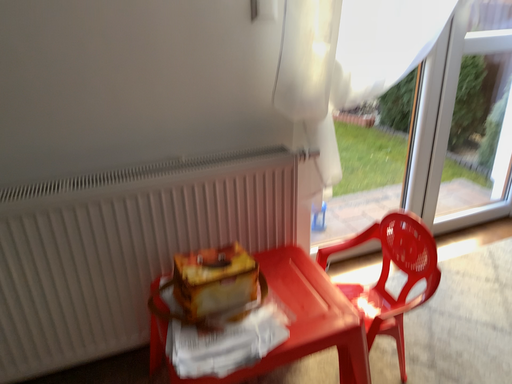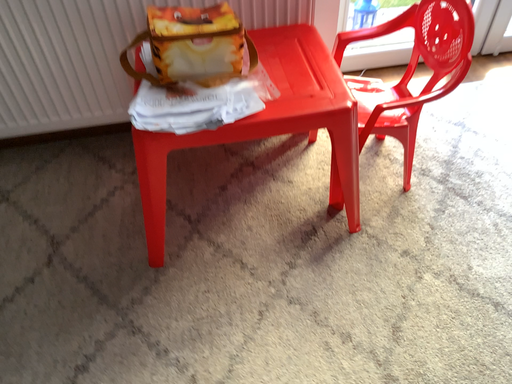
Question: How did the camera likely rotate when shooting the video?

Choices:
 (A) rotated left
 (B) rotated right

Answer: (A)